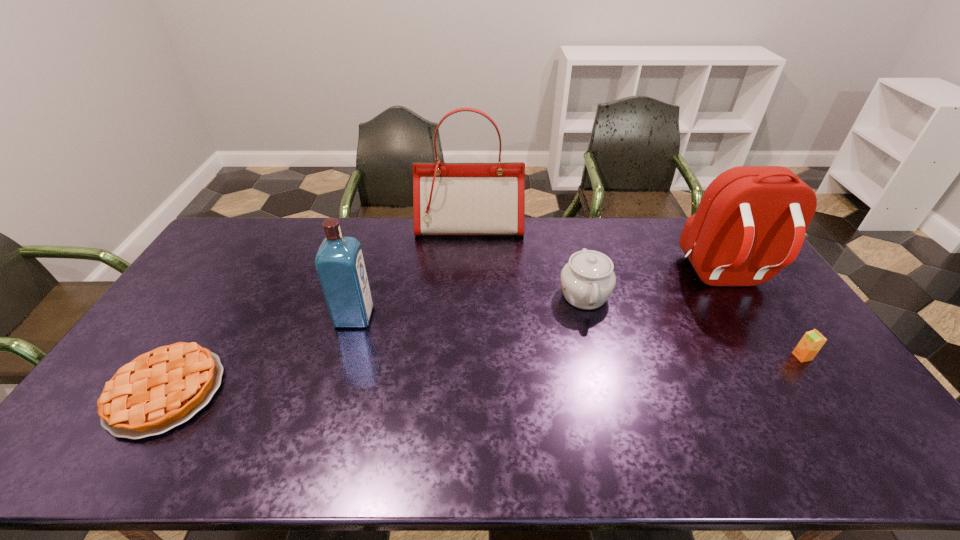
The image size is (960, 540). I want to click on backpack present at the right edge, so click(x=750, y=223).

The image size is (960, 540). I want to click on orange juice at the right edge, so click(810, 344).

You are a GUI agent. You are given a task and a screenshot of the screen. Output one action in this format:
    pyautogui.click(x=<x>, y=<y>)
    Task: Click on the object that is at the near left corner
    This screenshot has height=540, width=960.
    Given the screenshot: What is the action you would take?
    pyautogui.click(x=161, y=389)

At what (x,y) coordinates should I click in order to perform the action: click on object that is at the far right corner. Please return your answer as a coordinate pair (x, y). Image resolution: width=960 pixels, height=540 pixels. Looking at the image, I should click on (750, 223).

Where is `vacant space at the far edge of the desktop`? vacant space at the far edge of the desktop is located at coordinates (494, 235).

Locate an element on the screen. Image resolution: width=960 pixels, height=540 pixels. vacant space at the near edge of the desktop is located at coordinates coord(448,444).

The image size is (960, 540). Identify the location of free space at the left edge of the desktop. (180, 329).

Locate an element on the screen. vacant area at the right edge is located at coordinates (780, 353).

You are a GUI agent. You are given a task and a screenshot of the screen. Output one action in this format:
    pyautogui.click(x=<x>, y=<y>)
    Task: Click on the free area in between the fourth object from right to left and the fifth tallest object
    Image resolution: width=960 pixels, height=540 pixels.
    Given the screenshot: What is the action you would take?
    pyautogui.click(x=636, y=292)

Where is `vacant space that is in between the farthest object and the chinaware`? vacant space that is in between the farthest object and the chinaware is located at coordinates (527, 261).